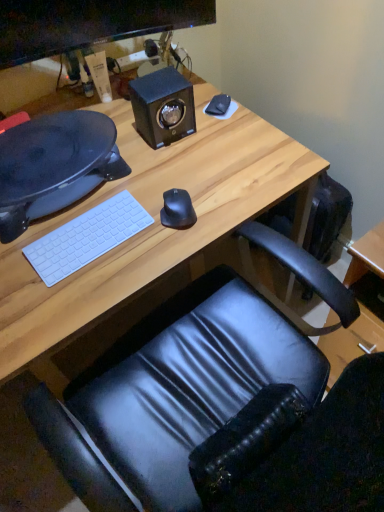
Question: Is wooden desk at center taller than white matte keyboard at lower left?

Choices:
 (A) no
 (B) yes

Answer: (B)

Question: From a real-world perspective, is wooden desk at center located higher than white matte keyboard at lower left?

Choices:
 (A) no
 (B) yes

Answer: (A)

Question: Considering the relative sizes of wooden desk at center and white matte keyboard at lower left in the image provided, is wooden desk at center thinner than white matte keyboard at lower left?

Choices:
 (A) no
 (B) yes

Answer: (A)

Question: Could you tell me if wooden desk at center is turned towards white matte keyboard at lower left?

Choices:
 (A) no
 (B) yes

Answer: (A)

Question: Can you confirm if wooden desk at center is bigger than white matte keyboard at lower left?

Choices:
 (A) yes
 (B) no

Answer: (A)

Question: From the image's perspective, would you say wooden desk at center is positioned over white matte keyboard at lower left?

Choices:
 (A) no
 (B) yes

Answer: (A)

Question: Is wooden desk at center to the left of black matte notepad at upper right from the viewer's perspective?

Choices:
 (A) yes
 (B) no

Answer: (A)

Question: Is wooden desk at center bigger than black matte notepad at upper right?

Choices:
 (A) yes
 (B) no

Answer: (A)

Question: Does wooden desk at center lie in front of black matte notepad at upper right?

Choices:
 (A) yes
 (B) no

Answer: (A)

Question: Does wooden desk at center have a greater height compared to black matte notepad at upper right?

Choices:
 (A) yes
 (B) no

Answer: (A)

Question: Is wooden desk at center surrounding black matte notepad at upper right?

Choices:
 (A) yes
 (B) no

Answer: (B)

Question: Does wooden desk at center come behind black matte notepad at upper right?

Choices:
 (A) no
 (B) yes

Answer: (A)

Question: From a real-world perspective, does black matte mouse at center stand above matte black monitor at upper left?

Choices:
 (A) no
 (B) yes

Answer: (A)